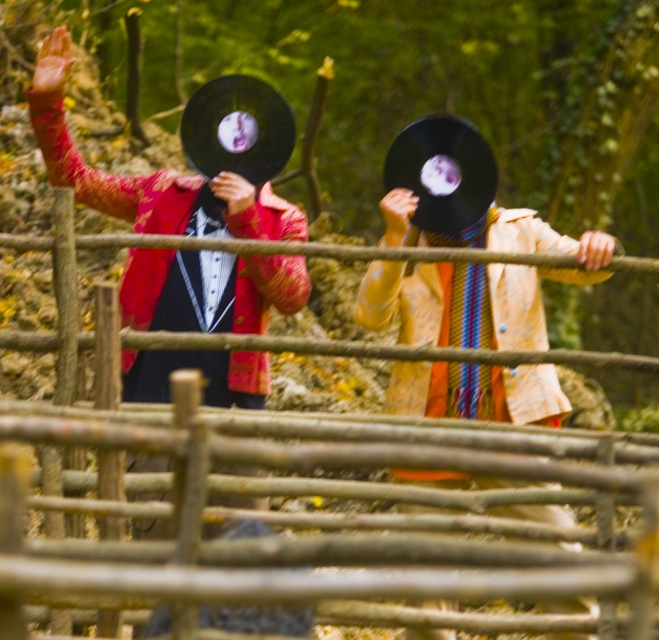
You are a photographer trying to capture a clear shot of the wooden at center and the matte black vinyl record at left. Since the fence is in focus, which object will appear more blurred in the photo?

The matte black vinyl record at left will appear more blurred because it is smaller than the wooden at center, which is larger and likely closer to the camera focus point.

You are a photographer trying to capture a clear shot of the wooden at center and the matte black vinyl record at left. Which object should you focus on first to ensure it appears sharp in your photo?

The wooden at center is closer to the viewer than the matte black vinyl record at left, so you should focus on the wooden at center first to ensure it appears sharp in your photo.